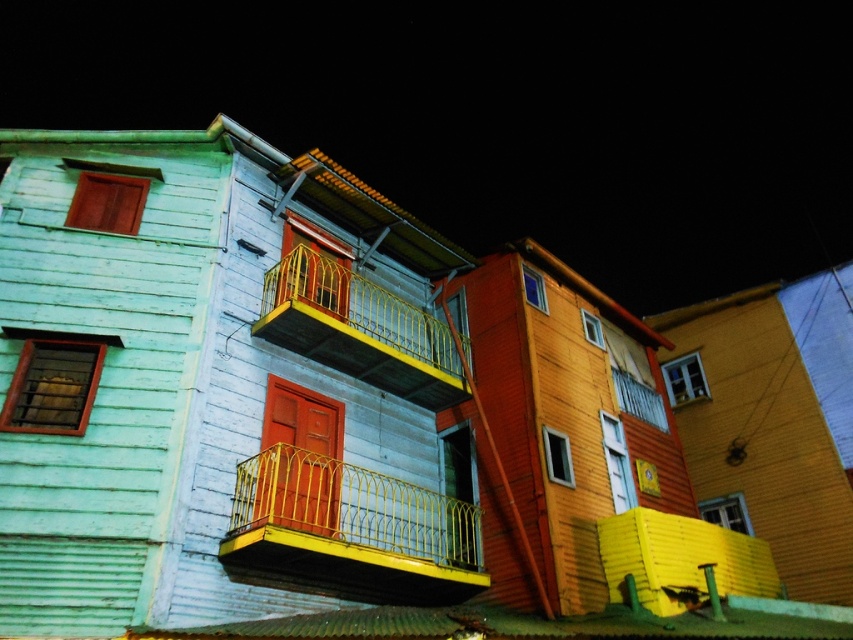
Question: Among these objects, which one is farthest from the camera?

Choices:
 (A) yellow metal railing at upper center
 (B) yellow metallic balcony at center

Answer: (A)

Question: Observing the image, what is the correct spatial positioning of wooden balcony at center in reference to yellow metal railing at upper center?

Choices:
 (A) right
 (B) left

Answer: (B)

Question: Which object appears closest to the camera in this image?

Choices:
 (A) yellow metallic balcony at center
 (B) yellow metal railing at upper center

Answer: (A)

Question: Estimate the real-world distances between objects in this image. Which object is closer to the yellow metallic balcony at center?

Choices:
 (A) yellow metal railing at upper center
 (B) wooden balcony at center

Answer: (A)

Question: From the image, what is the correct spatial relationship of wooden balcony at center in relation to yellow metallic balcony at center?

Choices:
 (A) below
 (B) above

Answer: (B)

Question: Is wooden balcony at center bigger than yellow metal railing at upper center?

Choices:
 (A) yes
 (B) no

Answer: (A)